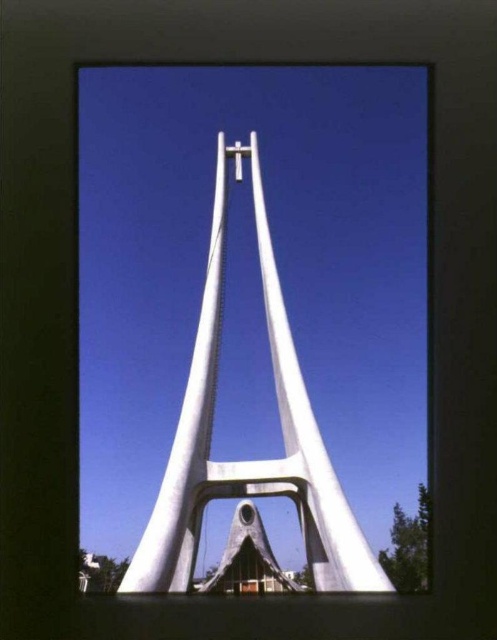
Which is above, white smooth monument at center or white matte cross at center?

Positioned higher is white matte cross at center.

Is white smooth monument at center smaller than white matte cross at center?

Incorrect, white smooth monument at center is not smaller in size than white matte cross at center.

Is point (299, 497) positioned before point (241, 148)?

Yes, it is in front of point (241, 148).

The width and height of the screenshot is (497, 640). In order to click on white smooth monument at center in this screenshot , I will do `click(248, 460)`.